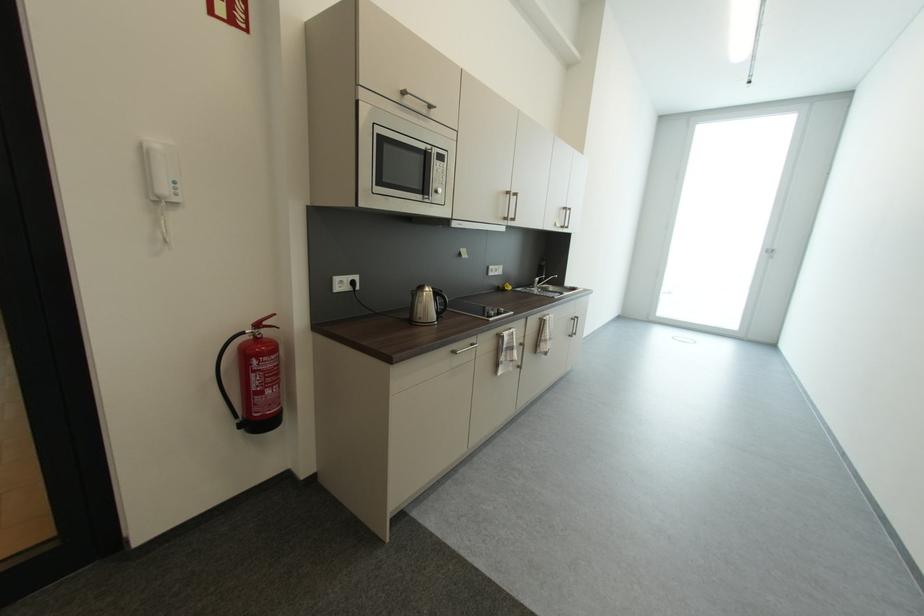
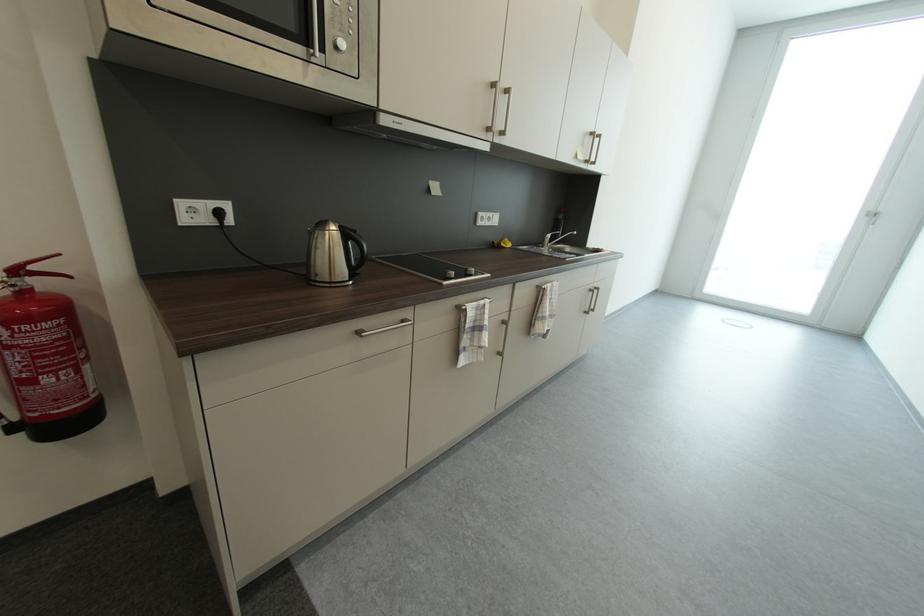
Locate, in the second image, the point that corresponds to the point at 439,291 in the first image.

(346, 228)